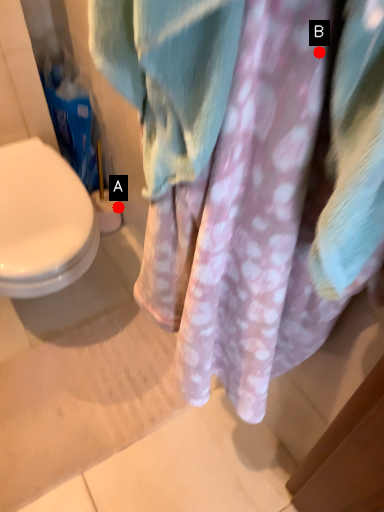
Question: Two points are circled on the image, labeled by A and B beside each circle. Which point is closer to the camera?

Choices:
 (A) A is closer
 (B) B is closer

Answer: (B)